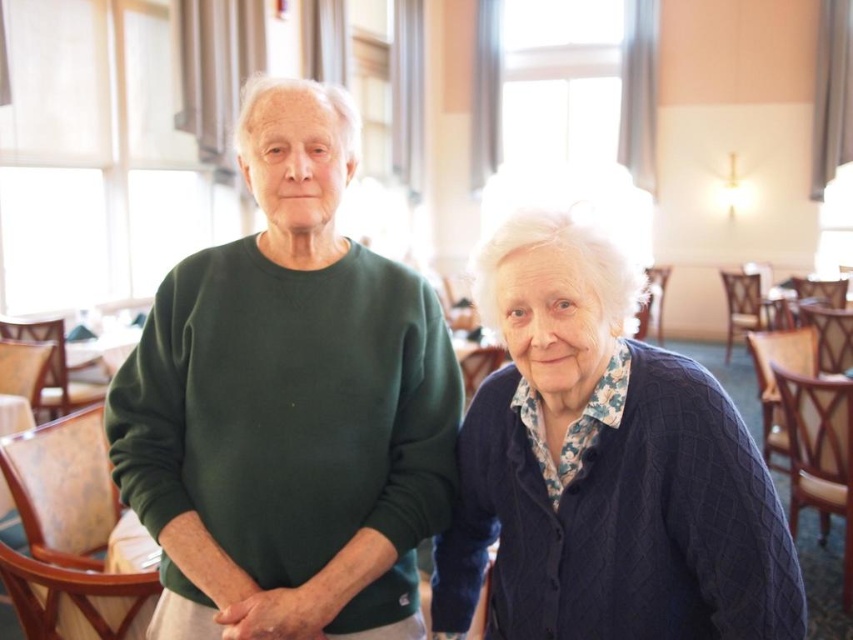
Question: Observing the image, what is the correct spatial positioning of green cotton sweater at center in reference to knitted navy cardigan at right?

Choices:
 (A) below
 (B) above

Answer: (B)

Question: Is green cotton sweater at center above knitted navy cardigan at right?

Choices:
 (A) yes
 (B) no

Answer: (A)

Question: Among these objects, which one is farthest from the camera?

Choices:
 (A) green cotton sweater at center
 (B) knitted navy cardigan at right

Answer: (A)

Question: From the image, what is the correct spatial relationship of green cotton sweater at center in relation to knitted navy cardigan at right?

Choices:
 (A) below
 (B) above

Answer: (B)